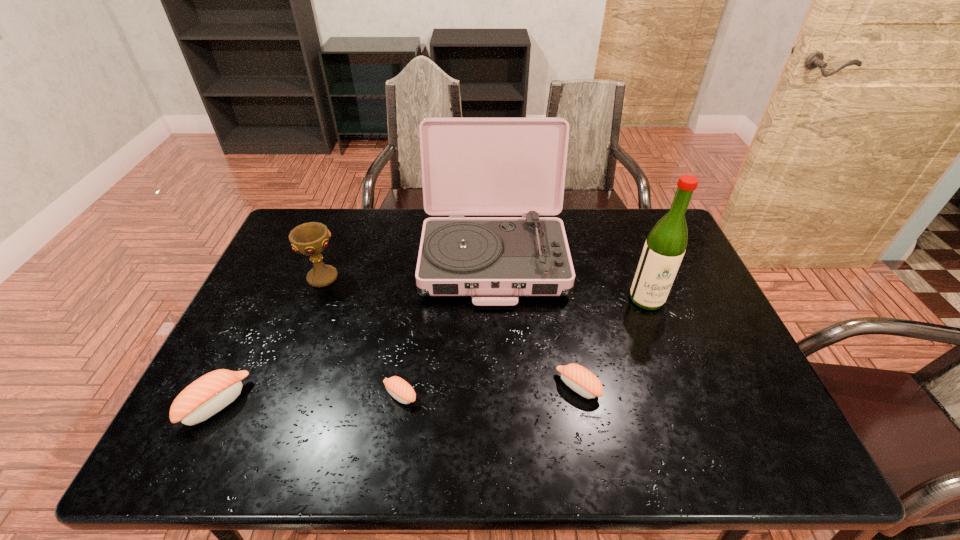
The width and height of the screenshot is (960, 540). Identify the location of vacant space that satisfies the following two spatial constraints: 1. on the back side of the second sushi from right to left; 2. on the right side of the rightmost sushi. (401, 387).